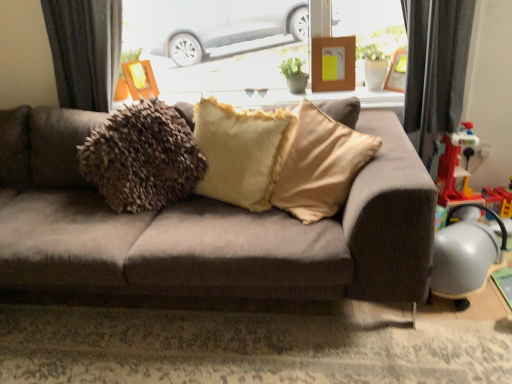
Measure the distance between wooden frame at upper right, arranged as the 1th picture frame when viewed from the right, and camera.

The depth of wooden frame at upper right, arranged as the 1th picture frame when viewed from the right, is 6.98 feet.

Locate an element on the screen. white glossy window sill at upper center is located at coordinates (308, 97).

Locate an element on the screen. This screenshot has height=384, width=512. fuzzy beige pillow at center is located at coordinates (240, 152).

Where is `metallic gray armchair at lower right`? The height and width of the screenshot is (384, 512). metallic gray armchair at lower right is located at coordinates point(466,256).

What is the approximate height of metallic gray armchair at lower right?

The height of metallic gray armchair at lower right is 12.08 inches.

Where is `wooden picture frame at upper center, marked as the second picture frame in a right-to-left arrangement`? The height and width of the screenshot is (384, 512). wooden picture frame at upper center, marked as the second picture frame in a right-to-left arrangement is located at coordinates (333, 63).

Where is `wooden frame at upper right, arranged as the 1th picture frame when viewed from the right`? This screenshot has width=512, height=384. wooden frame at upper right, arranged as the 1th picture frame when viewed from the right is located at coordinates (397, 72).

Which object is closer to the camera taking this photo, metallic silver toy at right or suede-like brown couch at center?

Positioned in front is suede-like brown couch at center.

Is metallic silver toy at right oriented towards suede-like brown couch at center?

No, metallic silver toy at right is not turned towards suede-like brown couch at center.

Consider the image. From a real-world perspective, which object rests below the other?

From a 3D spatial view, metallic silver toy at right is below.

Does point (207, 104) appear closer or farther from the camera than point (490, 234)?

Point (207, 104) is positioned farther from the camera compared to point (490, 234).

Can you confirm if fuzzy beige pillow at center is positioned to the left of metallic gray armchair at lower right?

Yes, fuzzy beige pillow at center is to the left of metallic gray armchair at lower right.

Considering the relative sizes of fuzzy beige pillow at center and metallic gray armchair at lower right in the image provided, is fuzzy beige pillow at center taller than metallic gray armchair at lower right?

Yes.

From the picture: Is fuzzy beige pillow at center outside of metallic gray armchair at lower right?

Yes, fuzzy beige pillow at center is not within metallic gray armchair at lower right.

Based on the photo, looking at their sizes, would you say transparent glass window at upper center is wider or thinner than metallic silver toy at right?

In the image, transparent glass window at upper center appears to be wider than metallic silver toy at right.

Which is in front, point (178, 76) or point (467, 193)?

Positioned in front is point (467, 193).

Find the location of `window screen that is above the metallic silver toy at right (from the image's perspective)`. window screen that is above the metallic silver toy at right (from the image's perspective) is located at coordinates (219, 44).

Is transparent glass window at upper center oriented away from metallic silver toy at right?

No, metallic silver toy at right is not at the back of transparent glass window at upper center.

Does point (495, 219) come farther from viewer compared to point (337, 78)?

No, it is not.

In terms of height, does metallic gray armchair at lower right look taller or shorter compared to wooden picture frame at upper center, which is the 2th picture frame in left-to-right order?

metallic gray armchair at lower right is taller than wooden picture frame at upper center, which is the 2th picture frame in left-to-right order.

Is metallic gray armchair at lower right positioned with its back to wooden picture frame at upper center, marked as the second picture frame in a right-to-left arrangement?

metallic gray armchair at lower right does not have its back to wooden picture frame at upper center, marked as the second picture frame in a right-to-left arrangement.

From the image's perspective, is metallic gray armchair at lower right under wooden picture frame at upper center, which is the 2th picture frame in left-to-right order?

Indeed, from the image's perspective, metallic gray armchair at lower right is shown beneath wooden picture frame at upper center, which is the 2th picture frame in left-to-right order.

From a real-world perspective, which is physically below, suede-like brown couch at center or wooden frame at upper right, arranged as the 1th picture frame when viewed from the right?

suede-like brown couch at center.

Which object is positioned more to the left, suede-like brown couch at center or wooden frame at upper right, positioned as the third picture frame in left-to-right order?

From the viewer's perspective, suede-like brown couch at center appears more on the left side.

Does suede-like brown couch at center lie behind wooden frame at upper right, arranged as the 1th picture frame when viewed from the right?

No, the depth of suede-like brown couch at center is less than that of wooden frame at upper right, arranged as the 1th picture frame when viewed from the right.

Based on the photo, who is shorter, white glossy window sill at upper center or suede-like brown couch at center?

Standing shorter between the two is white glossy window sill at upper center.

Which of these two, white glossy window sill at upper center or suede-like brown couch at center, is thinner?

white glossy window sill at upper center is thinner.

Is white glossy window sill at upper center in front of or behind suede-like brown couch at center in the image?

white glossy window sill at upper center is positioned farther from the viewer than suede-like brown couch at center.

From a real-world perspective, which is physically above, white glossy window sill at upper center or suede-like brown couch at center?

white glossy window sill at upper center is physically above.

From their relative heights in the image, would you say wooden frame at upper right, positioned as the third picture frame in left-to-right order, is taller or shorter than fuzzy beige pillow at center?

wooden frame at upper right, positioned as the third picture frame in left-to-right order, is shorter than fuzzy beige pillow at center.

Is wooden frame at upper right, arranged as the 1th picture frame when viewed from the right, to the left of fuzzy beige pillow at center from the viewer's perspective?

No.

Is wooden frame at upper right, arranged as the 1th picture frame when viewed from the right, inside the boundaries of fuzzy beige pillow at center, or outside?

wooden frame at upper right, arranged as the 1th picture frame when viewed from the right, cannot be found inside fuzzy beige pillow at center.

Locate an element on the screen. The image size is (512, 384). studio couch on the left of metallic silver toy at right is located at coordinates (207, 230).

Identify the location of armchair below the fuzzy beige pillow at center (from the image's perspective). (466, 256).

Considering their positions, is suede-like brown couch at center positioned closer to white glossy window sill at upper center than wooden frame at upper center, which is counted as the 1th picture frame, starting from the left?

Based on the image, wooden frame at upper center, which is counted as the 1th picture frame, starting from the left, appears to be nearer to white glossy window sill at upper center.

Considering their positions, is wooden frame at upper center, which is counted as the 1th picture frame, starting from the left, positioned further to wooden frame at upper right, arranged as the 1th picture frame when viewed from the right, than fuzzy beige pillow at center?

wooden frame at upper center, which is counted as the 1th picture frame, starting from the left, lies further to wooden frame at upper right, arranged as the 1th picture frame when viewed from the right, than the other object.

Considering their positions, is wooden frame at upper center, the 3th picture frame viewed from the right, positioned closer to transparent glass window at upper center than wooden picture frame at upper center, marked as the second picture frame in a right-to-left arrangement?

Among the two, wooden picture frame at upper center, marked as the second picture frame in a right-to-left arrangement, is located nearer to transparent glass window at upper center.

Which object lies further to the anchor point wooden frame at upper center, the 3th picture frame viewed from the right, metallic gray armchair at lower right or metallic silver toy at right?

metallic gray armchair at lower right is further to wooden frame at upper center, the 3th picture frame viewed from the right.

From the image, which object appears to be farther from wooden picture frame at upper center, which is the 2th picture frame in left-to-right order, fuzzy beige pillow at center or metallic gray armchair at lower right?

metallic gray armchair at lower right is further to wooden picture frame at upper center, which is the 2th picture frame in left-to-right order.

From the image, which object appears to be farther from wooden picture frame at upper center, marked as the second picture frame in a right-to-left arrangement, wooden frame at upper right, arranged as the 1th picture frame when viewed from the right, or suede-like brown couch at center?

suede-like brown couch at center lies further to wooden picture frame at upper center, marked as the second picture frame in a right-to-left arrangement, than the other object.

Which object lies nearer to the anchor point transparent glass window at upper center, suede-like brown couch at center or wooden frame at upper center, which is counted as the 1th picture frame, starting from the left?

Among the two, wooden frame at upper center, which is counted as the 1th picture frame, starting from the left, is located nearer to transparent glass window at upper center.

Looking at the image, which one is located further to wooden frame at upper center, which is counted as the 1th picture frame, starting from the left, fuzzy beige pillow at center or metallic silver toy at right?

metallic silver toy at right is further to wooden frame at upper center, which is counted as the 1th picture frame, starting from the left.

The height and width of the screenshot is (384, 512). I want to click on window sill between wooden frame at upper center, the 3th picture frame viewed from the right, and wooden picture frame at upper center, marked as the second picture frame in a right-to-left arrangement, from left to right, so click(x=308, y=97).

Where is `window sill between fuzzy beige pillow at center and metallic gray armchair at lower right in the horizontal direction`? This screenshot has height=384, width=512. window sill between fuzzy beige pillow at center and metallic gray armchair at lower right in the horizontal direction is located at coordinates (308, 97).

Where is `window sill between fuzzy beige pillow at center and metallic silver toy at right in the horizontal direction`? Image resolution: width=512 pixels, height=384 pixels. window sill between fuzzy beige pillow at center and metallic silver toy at right in the horizontal direction is located at coordinates (308, 97).

What are the coordinates of `pillow between transparent glass window at upper center and metallic gray armchair at lower right from top to bottom` in the screenshot? It's located at (240, 152).